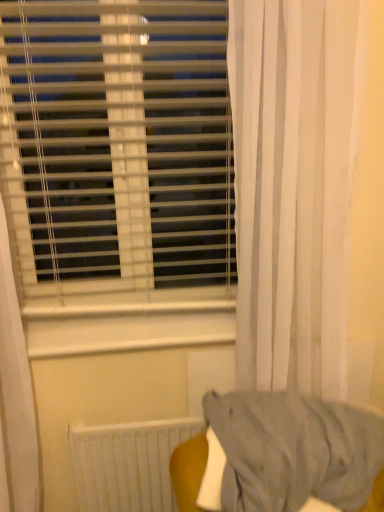
Question: From a real-world perspective, is white plastic blinds at upper left physically located above or below white matte radiator at lower center?

Choices:
 (A) above
 (B) below

Answer: (A)

Question: In terms of width, does white plastic blinds at upper left look wider or thinner when compared to white matte radiator at lower center?

Choices:
 (A) thin
 (B) wide

Answer: (A)

Question: Considering the real-world distances, which object is closest to the white matte radiator at lower center?

Choices:
 (A) white sheer curtain at right
 (B) white plastic blinds at upper left

Answer: (A)

Question: Which object is the farthest from the white sheer curtain at right?

Choices:
 (A) white plastic blinds at upper left
 (B) white matte radiator at lower center

Answer: (B)